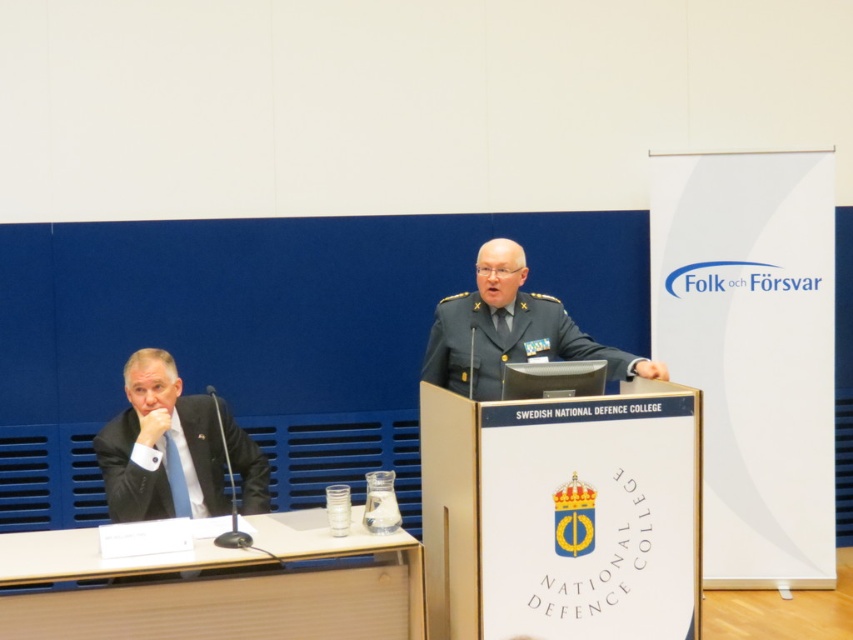
You are a photographer at the event and need to capture a clear photo of the black suit at left. The camera you are using has a minimum focusing distance of 11 feet. Can you take the photo without moving closer?

The black suit at left and camera are 10.99 feet apart, which is just under the camera minimum focusing distance of 11 feet. Therefore, you can take the photo without moving closer.

You are attending a seminar at the Swedish National Defence College and need to place a document on the light brown wood table at lower left. To do so, you must walk from your current position near the uniformed military officer at center. Is the table within reach without needing to go around any obstacles?

The light brown wood table at lower left is in front of the uniformed military officer at center, so you can directly walk forward from the officer to reach the table without needing to go around any obstacles.

You are standing in the conference room and need to move from the speaker to the exit located at the back of the room. The speaker is at point (270, 561) and the exit is at point (152, 422). Since you want to avoid walking in front of the speaker, should you walk around the podium or go directly towards the exit?

Point (270, 561) is in front of point (152, 422), so the exit is behind the speaker. Therefore, you should walk around the podium to avoid walking in front of the speaker.